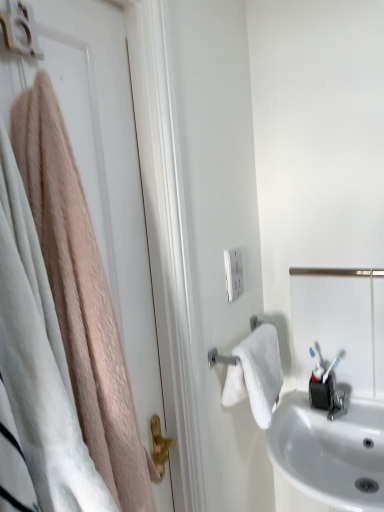
Question: From a real-world perspective, does white glossy sink at lower right sit lower than white plastic outlet at center?

Choices:
 (A) no
 (B) yes

Answer: (B)

Question: Can you confirm if white glossy sink at lower right is taller than white plastic outlet at center?

Choices:
 (A) no
 (B) yes

Answer: (B)

Question: Is white plastic outlet at center at the back of white glossy sink at lower right?

Choices:
 (A) yes
 (B) no

Answer: (B)

Question: Is white glossy sink at lower right smaller than white plastic outlet at center?

Choices:
 (A) no
 (B) yes

Answer: (A)

Question: Is there a large distance between white glossy sink at lower right and white plastic outlet at center?

Choices:
 (A) no
 (B) yes

Answer: (A)

Question: From the image's perspective, relative to white glossy sink at lower right, is white plastic outlet at center above or below?

Choices:
 (A) above
 (B) below

Answer: (A)

Question: In the image, is white plastic outlet at center positioned in front of or behind white glossy sink at lower right?

Choices:
 (A) behind
 (B) front

Answer: (A)

Question: From a real-world perspective, relative to white glossy sink at lower right, is white plastic outlet at center vertically above or below?

Choices:
 (A) above
 (B) below

Answer: (A)

Question: In terms of height, does white plastic outlet at center look taller or shorter compared to white glossy sink at lower right?

Choices:
 (A) short
 (B) tall

Answer: (A)

Question: From the image's perspective, is white matte door at left above or below satin silver mirror at right?

Choices:
 (A) above
 (B) below

Answer: (A)

Question: Considering the positions of white matte door at left and satin silver mirror at right in the image, is white matte door at left wider or thinner than satin silver mirror at right?

Choices:
 (A) thin
 (B) wide

Answer: (B)

Question: Is white matte door at left inside the boundaries of satin silver mirror at right, or outside?

Choices:
 (A) inside
 (B) outside

Answer: (B)

Question: Does point (114, 19) appear closer or farther from the camera than point (382, 309)?

Choices:
 (A) closer
 (B) farther

Answer: (A)

Question: From a real-world perspective, is satin silver mirror at right above or below white matte door at left?

Choices:
 (A) below
 (B) above

Answer: (A)

Question: Considering the positions of point (339, 333) and point (84, 104), is point (339, 333) closer or farther from the camera than point (84, 104)?

Choices:
 (A) farther
 (B) closer

Answer: (A)